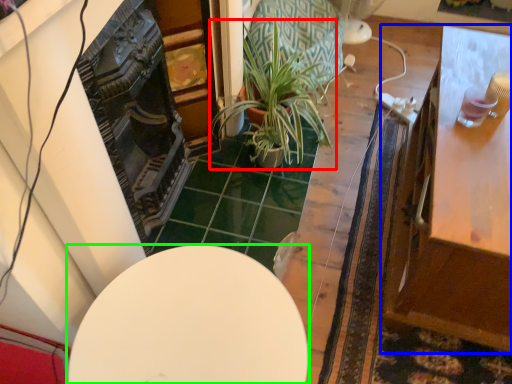
Question: Which is nearer to the houseplant (highlighted by a red box)? table (highlighted by a blue box) or table (highlighted by a green box).

Choices:
 (A) table
 (B) table

Answer: (A)